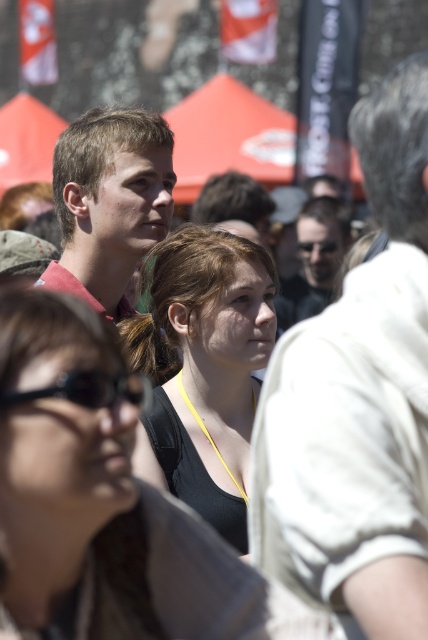
Which is above, matte black tank top at center or matte red shirt at center?

Positioned higher is matte red shirt at center.

Does matte black tank top at center have a greater height compared to matte red shirt at center?

Correct, matte black tank top at center is much taller as matte red shirt at center.

Describe the element at coordinates (205, 365) in the screenshot. This screenshot has width=428, height=640. I see `matte black tank top at center` at that location.

At what (x,y) coordinates should I click in order to perform the action: click on matte black tank top at center. Please return your answer as a coordinate pair (x, y). Looking at the image, I should click on (205, 365).

Does matte black sunglasses at center appear over black matte goggles at center?

Incorrect, matte black sunglasses at center is not positioned above black matte goggles at center.

Who is higher up, matte black sunglasses at center or black matte goggles at center?

black matte goggles at center

You are a GUI agent. You are given a task and a screenshot of the screen. Output one action in this format:
    pyautogui.click(x=<x>, y=<y>)
    Task: Click on the matte black sunglasses at center
    Image resolution: width=428 pixels, height=640 pixels.
    Given the screenshot: What is the action you would take?
    pyautogui.click(x=315, y=259)

Locate an element on the screen. matte black sunglasses at center is located at coordinates (315, 259).

In order to click on matte red shirt at center in this screenshot , I will do `click(109, 202)`.

Who is shorter, matte red shirt at center or matte black sunglasses at center?

matte black sunglasses at center

Which is in front, point (92, 109) or point (348, 234)?

Point (92, 109) is more forward.

Identify the location of matte red shirt at center. The width and height of the screenshot is (428, 640). (109, 202).